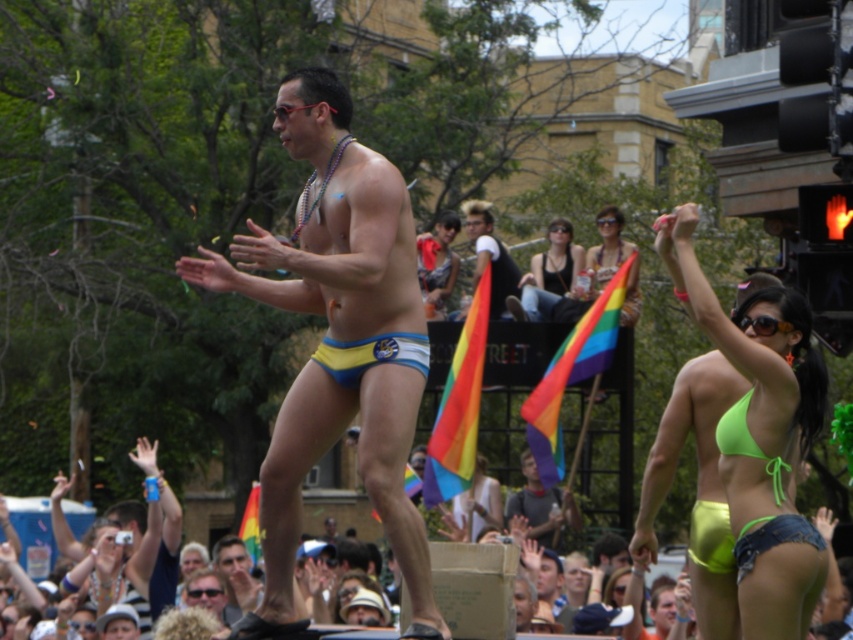
Question: Does yellow-blue striped underwear at center appear on the left side of camouflage-patterned shorts at center?

Choices:
 (A) no
 (B) yes

Answer: (B)

Question: From the image, what is the correct spatial relationship of neon green bikini at lower right in relation to camouflage-patterned shorts at center?

Choices:
 (A) left
 (B) right

Answer: (B)

Question: Which object is the farthest from the matte yellow bikini bottom at center?

Choices:
 (A) neon green bikini at lower right
 (B) matte blue shorts at center
 (C) green fabric crowd at lower center
 (D) camouflage-patterned shorts at center

Answer: (A)

Question: Is neon green bikini top at upper right to the left of rainbow flag at upper center from the viewer's perspective?

Choices:
 (A) no
 (B) yes

Answer: (A)

Question: Estimate the real-world distances between objects in this image. Which object is closer to the green fabric crowd at lower center?

Choices:
 (A) neon green bikini at upper right
 (B) yellow-blue striped underwear at center
 (C) rainbow flag at upper center

Answer: (B)

Question: Among these points, which one is farthest from the camera?

Choices:
 (A) (485, 611)
 (B) (529, 524)
 (C) (607, 225)

Answer: (C)